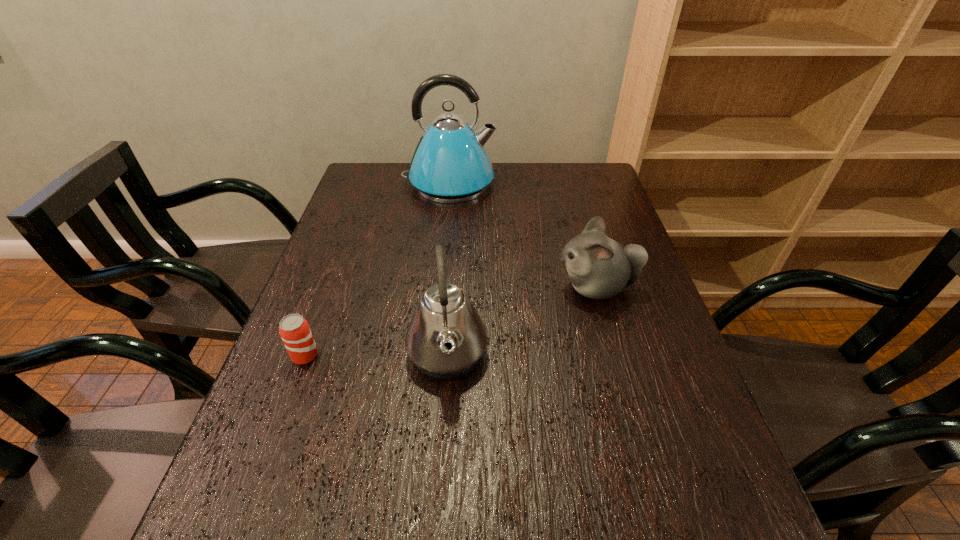
You are a GUI agent. You are given a task and a screenshot of the screen. Output one action in this format:
    pyautogui.click(x=<x>, y=<y>)
    Task: Click on the vacant space at the far left corner
    
    Given the screenshot: What is the action you would take?
    pyautogui.click(x=367, y=188)

In the image, there is a desktop. Where is `free space at the near left corner`? This screenshot has height=540, width=960. free space at the near left corner is located at coordinates point(211,527).

Where is `free spot at the far right corner of the desktop`? The image size is (960, 540). free spot at the far right corner of the desktop is located at coordinates (563, 186).

The width and height of the screenshot is (960, 540). Identify the location of free point at the near right corner. (683, 526).

In order to click on vacant area that lies between the second farthest object and the farthest object in this screenshot , I will do 523,236.

You are a GUI agent. You are given a task and a screenshot of the screen. Output one action in this format:
    pyautogui.click(x=<x>, y=<y>)
    Task: Click on the blank region between the shorter kettle and the farthest object
    The image size is (960, 540).
    Given the screenshot: What is the action you would take?
    pyautogui.click(x=448, y=269)

This screenshot has height=540, width=960. I want to click on vacant area that lies between the shorter kettle and the third nearest object, so click(x=522, y=321).

This screenshot has height=540, width=960. I want to click on free point between the hamster and the second tallest object, so click(522, 321).

At what (x,y) coordinates should I click in order to perform the action: click on free space between the taller kettle and the rightmost object. Please return your answer as a coordinate pair (x, y). Image resolution: width=960 pixels, height=540 pixels. Looking at the image, I should click on (523, 236).

Where is `vacant space that is in between the beer can and the nearer kettle`? This screenshot has width=960, height=540. vacant space that is in between the beer can and the nearer kettle is located at coordinates (376, 355).